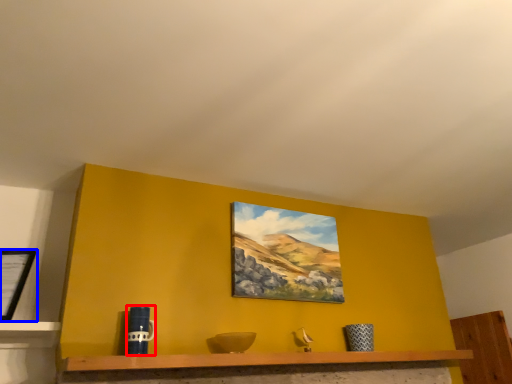
Question: Which object appears closest to the camera in this image, mug (highlighted by a red box) or picture frame (highlighted by a blue box)?

Choices:
 (A) mug
 (B) picture frame

Answer: (A)